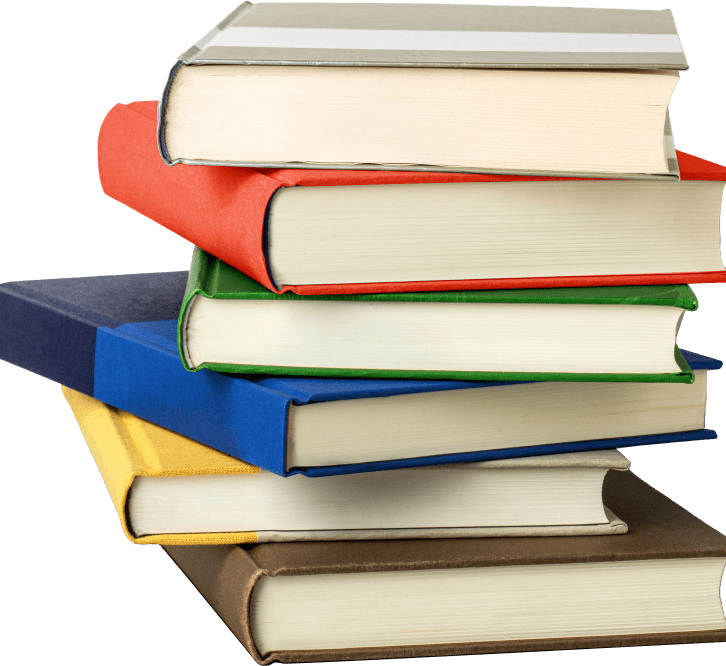
Locate an element on the screen. The height and width of the screenshot is (666, 726). books is located at coordinates (232, 128), (300, 238), (255, 314), (181, 387), (168, 487), (293, 603).